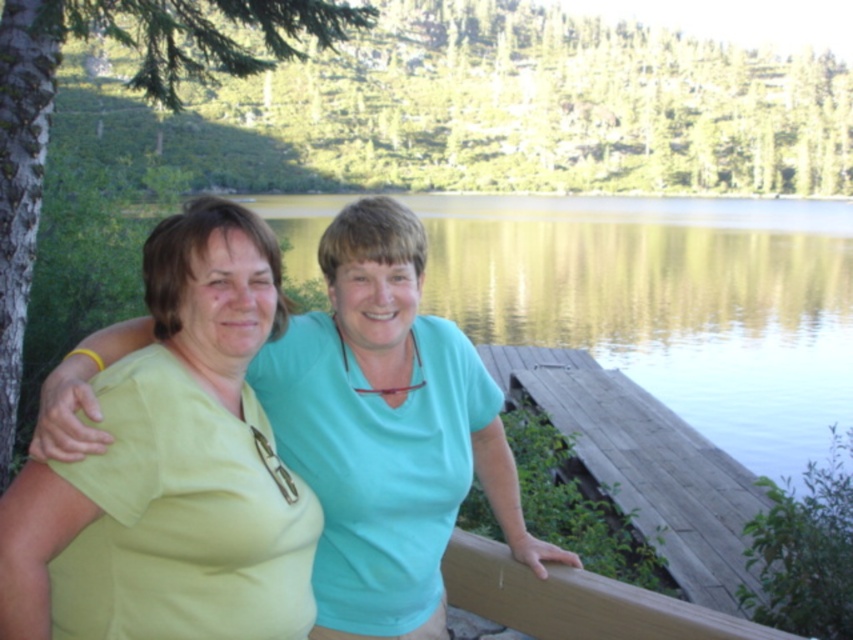
You are a photographer trying to capture the scene with the matte green shirt at center and the brown wood rail at lower center. Which object is positioned higher in the image?

The matte green shirt at center is above the brown wood rail at lower center, so the matte green shirt at center is positioned higher in the image.

You are a photographer wanting to capture the matte green shirt at center and the wooden dock at lower right in the same frame. Based on their positions, can you determine which object is higher from the ground?

The matte green shirt at center is above the wooden dock at lower right, so the matte green shirt at center is higher from the ground.

You are a photographer trying to capture a photo of the matte green shirt at center and the wooden dock at lower right. Which object appears narrower in the photo?

The matte green shirt at center appears narrower than the wooden dock at lower right in the photo.